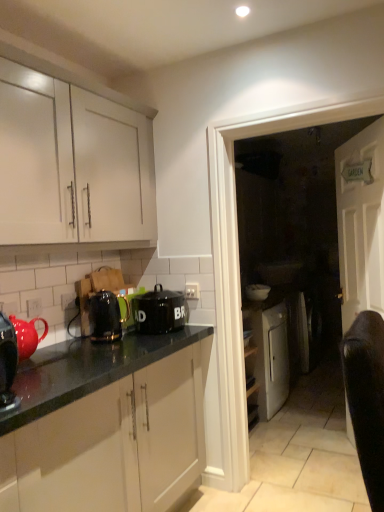
Measure the distance between metallic black toaster at center-left, arranged as the second kitchen appliance when viewed from the back, and camera.

The depth of metallic black toaster at center-left, arranged as the second kitchen appliance when viewed from the back, is 2.10 meters.

Where is `metallic black toaster at center-left, the second kitchen appliance from the right`? metallic black toaster at center-left, the second kitchen appliance from the right is located at coordinates (106, 316).

This screenshot has width=384, height=512. Describe the element at coordinates (361, 222) in the screenshot. I see `white wooden door at center` at that location.

Identify the location of black ceramic canister at center, which is the third kitchen appliance in front-to-back order. This screenshot has width=384, height=512. (159, 311).

What do you see at coordinates (7, 362) in the screenshot? I see `shiny black kettle at left, positioned as the 1th kitchen appliance in front-to-back order` at bounding box center [7, 362].

Where is `shiny black kettle at left, the 3th kitchen appliance viewed from the back`? shiny black kettle at left, the 3th kitchen appliance viewed from the back is located at coordinates (7, 362).

Find the location of a particular element. The width and height of the screenshot is (384, 512). metallic black toaster at center-left, acting as the second kitchen appliance starting from the left is located at coordinates (106, 316).

Considering the sizes of objects black ceramic canister at center, the 3th kitchen appliance viewed from the left, and matte ceramic teapot at left in the image provided, who is smaller, black ceramic canister at center, the 3th kitchen appliance viewed from the left, or matte ceramic teapot at left?

Smaller between the two is matte ceramic teapot at left.

Locate an element on the screen. tea pot that appears below the black ceramic canister at center, which is counted as the 1th kitchen appliance, starting from the right (from the image's perspective) is located at coordinates (27, 335).

Is black ceramic canister at center, arranged as the 1th kitchen appliance when viewed from the back, taller than matte ceramic teapot at left?

A: Correct, black ceramic canister at center, arranged as the 1th kitchen appliance when viewed from the back, is much taller as matte ceramic teapot at left.

Could matte ceramic teapot at left be considered to be inside black ceramic canister at center, which is the third kitchen appliance in front-to-back order?

That's incorrect, matte ceramic teapot at left is not inside black ceramic canister at center, which is the third kitchen appliance in front-to-back order.

Is white wooden door at center facing towards metallic black toaster at center-left, acting as the second kitchen appliance starting from the left?

Yes, white wooden door at center is oriented towards metallic black toaster at center-left, acting as the second kitchen appliance starting from the left.

Is point (378, 275) more distant than point (101, 304)?

Yes.

Which is correct: white wooden door at center is inside metallic black toaster at center-left, the second kitchen appliance from the right, or outside of it?

white wooden door at center is located beyond the bounds of metallic black toaster at center-left, the second kitchen appliance from the right.

Considering the sizes of objects black ceramic canister at center, the 3th kitchen appliance viewed from the left, and white matte cabinet at upper left in the image provided, who is shorter, black ceramic canister at center, the 3th kitchen appliance viewed from the left, or white matte cabinet at upper left?

black ceramic canister at center, the 3th kitchen appliance viewed from the left, is shorter.

Are black ceramic canister at center, which is the third kitchen appliance in front-to-back order, and white matte cabinet at upper left far apart?

black ceramic canister at center, which is the third kitchen appliance in front-to-back order, is near white matte cabinet at upper left, not far away.

Is white matte cabinet at upper left at the back of black ceramic canister at center, which is the third kitchen appliance in front-to-back order?

No, white matte cabinet at upper left is not at the back of black ceramic canister at center, which is the third kitchen appliance in front-to-back order.

Considering the positions of point (168, 302) and point (82, 218), is point (168, 302) closer or farther from the camera than point (82, 218)?

Point (168, 302).

In terms of height, does matte ceramic teapot at left look taller or shorter compared to black ceramic canister at center, which is counted as the 1th kitchen appliance, starting from the right?

matte ceramic teapot at left is shorter than black ceramic canister at center, which is counted as the 1th kitchen appliance, starting from the right.

Is black ceramic canister at center, which is the third kitchen appliance in front-to-back order, inside matte ceramic teapot at left?

No, black ceramic canister at center, which is the third kitchen appliance in front-to-back order, is located outside of matte ceramic teapot at left.

Does matte ceramic teapot at left lie in front of black ceramic canister at center, which is the third kitchen appliance in front-to-back order?

Yes, it is in front of black ceramic canister at center, which is the third kitchen appliance in front-to-back order.

Is matte ceramic teapot at left wider or thinner than black ceramic canister at center, the 3th kitchen appliance viewed from the left?

matte ceramic teapot at left is thinner than black ceramic canister at center, the 3th kitchen appliance viewed from the left.

Could you measure the distance between shiny black kettle at left, placed as the 1th kitchen appliance when sorted from left to right, and white glossy door at center?

4.32 feet.

Between shiny black kettle at left, placed as the third kitchen appliance when sorted from right to left, and white glossy door at center, which one has less height?

Standing shorter between the two is shiny black kettle at left, placed as the third kitchen appliance when sorted from right to left.

Identify the location of the 3rd kitchen appliance to the left of the white glossy door at center, counting from the anchor's position. The height and width of the screenshot is (512, 384). (7, 362).

Which of these two, shiny black kettle at left, the 3th kitchen appliance viewed from the back, or white glossy door at center, is bigger?

With larger size is white glossy door at center.

Based on the photo, considering the relative positions of metallic black toaster at center-left, arranged as the second kitchen appliance when viewed from the back, and matte ceramic teapot at left in the image provided, is metallic black toaster at center-left, arranged as the second kitchen appliance when viewed from the back, to the left or to the right of matte ceramic teapot at left?

In the image, metallic black toaster at center-left, arranged as the second kitchen appliance when viewed from the back, appears on the right side of matte ceramic teapot at left.

Is point (101, 304) in front of point (32, 324)?

No, (101, 304) is behind (32, 324).

Consider the image. From a real-world perspective, which is physically below, metallic black toaster at center-left, arranged as the second kitchen appliance when viewed from the back, or matte ceramic teapot at left?

matte ceramic teapot at left.

Can you tell me how much metallic black toaster at center-left, acting as the second kitchen appliance starting from the left, and matte ceramic teapot at left differ in facing direction?

The facing directions of metallic black toaster at center-left, acting as the second kitchen appliance starting from the left, and matte ceramic teapot at left are 3.73 degrees apart.

Which is in front, point (151, 309) or point (2, 389)?

The point (2, 389) is in front.

Considering the sizes of black ceramic canister at center, which is counted as the 1th kitchen appliance, starting from the right, and shiny black kettle at left, placed as the 1th kitchen appliance when sorted from left to right, in the image, is black ceramic canister at center, which is counted as the 1th kitchen appliance, starting from the right, taller or shorter than shiny black kettle at left, placed as the 1th kitchen appliance when sorted from left to right,?

Clearly, black ceramic canister at center, which is counted as the 1th kitchen appliance, starting from the right, is shorter compared to shiny black kettle at left, placed as the 1th kitchen appliance when sorted from left to right.

Looking at this image, is the position of black ceramic canister at center, the 3th kitchen appliance viewed from the left, more distant than that of shiny black kettle at left, placed as the 1th kitchen appliance when sorted from left to right?

Yes, black ceramic canister at center, the 3th kitchen appliance viewed from the left, is further from the viewer.

Is black ceramic canister at center, the 3th kitchen appliance viewed from the left, oriented away from shiny black kettle at left, placed as the 1th kitchen appliance when sorted from left to right?

That's not correct — black ceramic canister at center, the 3th kitchen appliance viewed from the left, is not looking away from shiny black kettle at left, placed as the 1th kitchen appliance when sorted from left to right.

Which kitchen appliance is the 2nd one when counting from the back of the matte ceramic teapot at left? Please provide its 2D coordinates.

[(159, 311)]

In order to click on door located in front of the metallic black toaster at center-left, the second kitchen appliance from the right in this screenshot , I will do `click(361, 222)`.

Looking at the image, which one is located closer to white wooden door at center, white glossy door at center or white matte cabinet at upper left?

white glossy door at center is closer to white wooden door at center.

Looking at the image, which one is located further to matte ceramic teapot at left, white matte cabinet at upper left or white glossy bowl at center?

white glossy bowl at center lies further to matte ceramic teapot at left than the other object.

When comparing their distances from shiny black kettle at left, placed as the third kitchen appliance when sorted from right to left, does white matte cabinet at upper left or white wooden door at center seem closer?

white matte cabinet at upper left is positioned closer to the anchor shiny black kettle at left, placed as the third kitchen appliance when sorted from right to left.

Which object lies further to the anchor point white glossy bowl at center, black ceramic canister at center, which is counted as the 1th kitchen appliance, starting from the right, or white matte cabinet at upper left?

white matte cabinet at upper left is positioned further to the anchor white glossy bowl at center.

Which object lies nearer to the anchor point matte ceramic teapot at left, white glossy bowl at center or white wooden door at center?

white wooden door at center is closer to matte ceramic teapot at left.

From the image, which object appears to be nearer to white glossy door at center, shiny black kettle at left, the 3th kitchen appliance viewed from the back, or matte ceramic teapot at left?

The object closer to white glossy door at center is matte ceramic teapot at left.

Which object lies further to the anchor point white wooden door at center, white glossy door at center or shiny black kettle at left, placed as the third kitchen appliance when sorted from right to left?

Based on the image, shiny black kettle at left, placed as the third kitchen appliance when sorted from right to left, appears to be further to white wooden door at center.

From the image, which object appears to be nearer to white glossy bowl at center, white matte cabinet at upper left or matte ceramic teapot at left?

white matte cabinet at upper left.

Find the location of a particular element. cabinetry between shiny black kettle at left, placed as the 1th kitchen appliance when sorted from left to right, and white wooden door at center is located at coordinates (71, 164).

Where is `cabinetry between shiny black kettle at left, positioned as the 1th kitchen appliance in front-to-back order, and white glossy door at center, in the horizontal direction`? cabinetry between shiny black kettle at left, positioned as the 1th kitchen appliance in front-to-back order, and white glossy door at center, in the horizontal direction is located at coordinates point(71,164).

Locate an element on the screen. The width and height of the screenshot is (384, 512). glass door situated between black ceramic canister at center, the 3th kitchen appliance viewed from the left, and white wooden door at center from left to right is located at coordinates (239, 269).

I want to click on kitchen appliance situated between metallic black toaster at center-left, which appears as the second kitchen appliance when viewed from the front, and white wooden door at center from left to right, so click(159, 311).